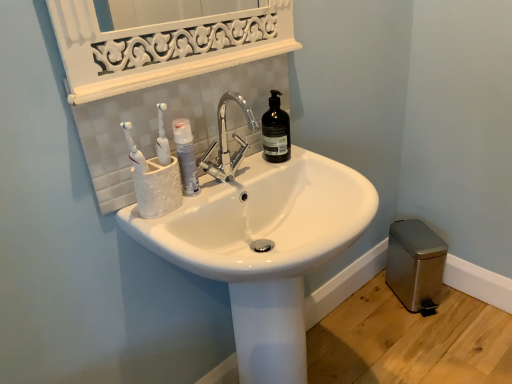
Where is `vacant space in front of black matte bottle at upper center`? vacant space in front of black matte bottle at upper center is located at coordinates (258, 170).